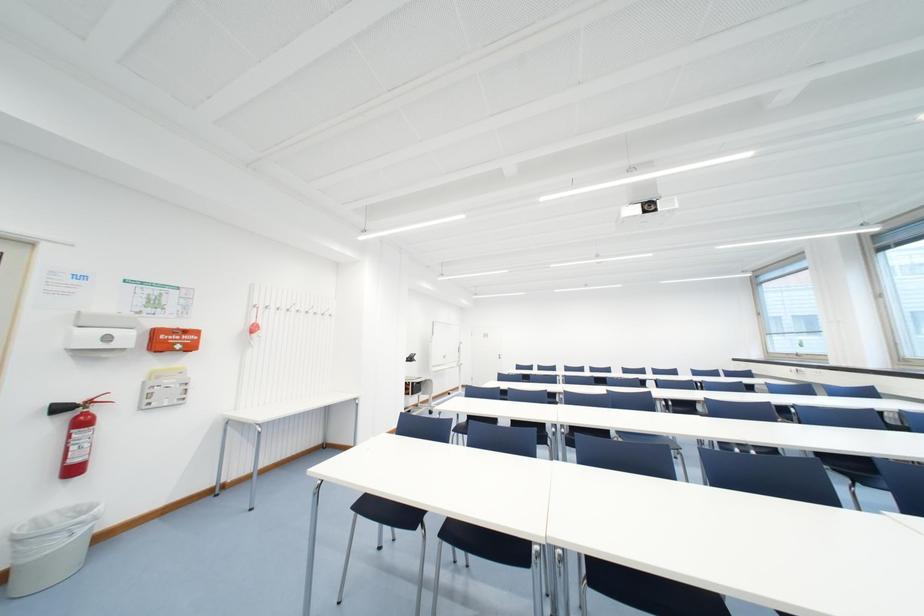
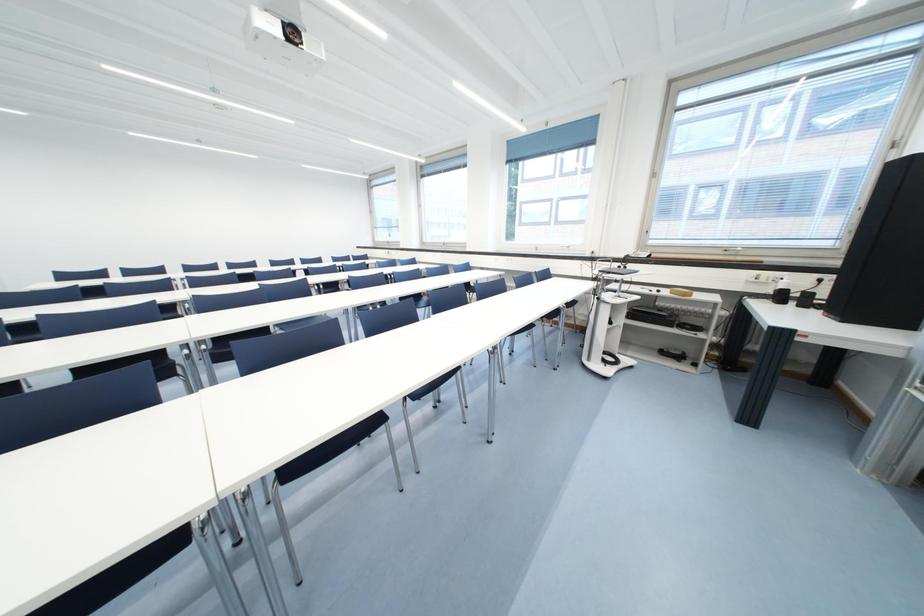
The first image is from the beginning of the video and the second image is from the end. How did the camera likely rotate when shooting the video?

The camera rotated toward right-down.